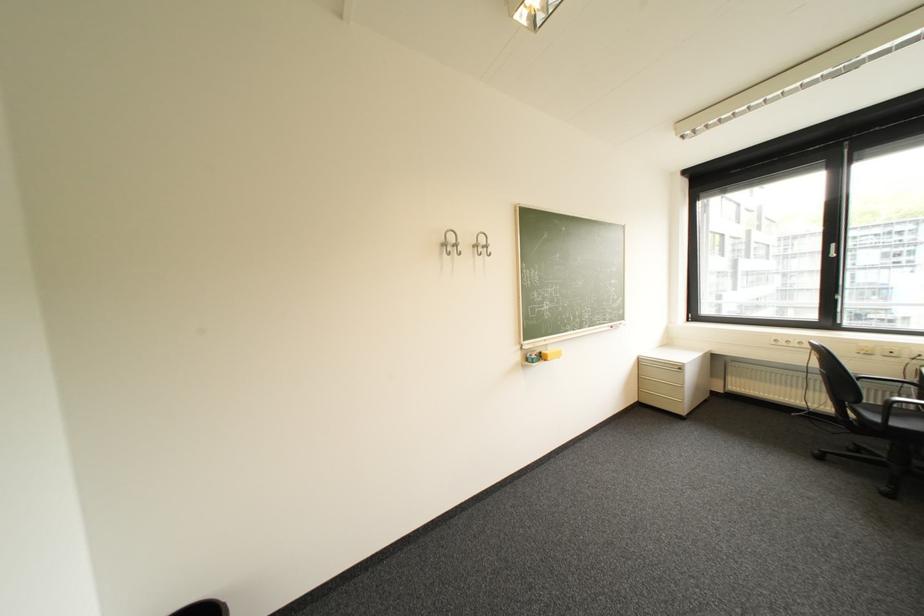
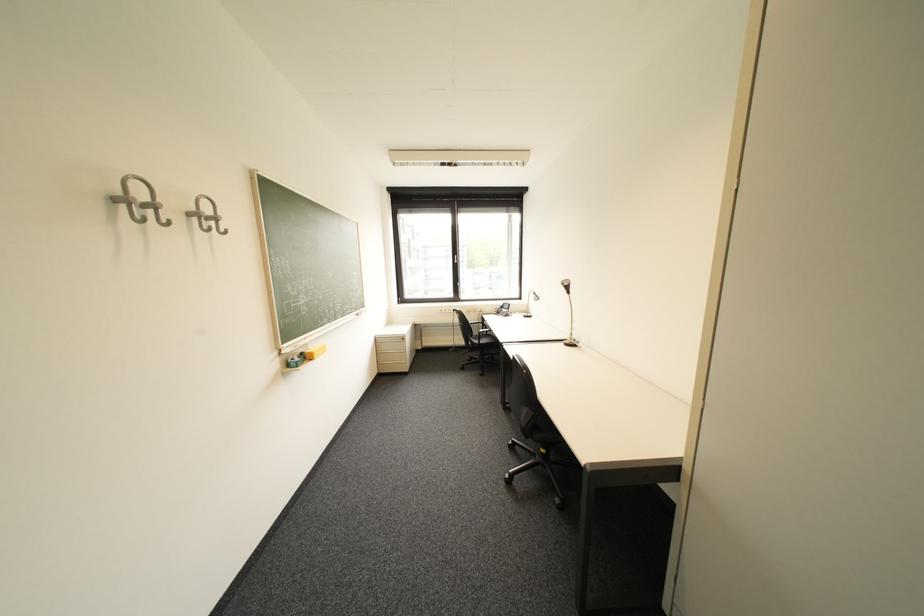
Find the pixel in the second image that matches the point at 651,363 in the first image.

(388, 342)